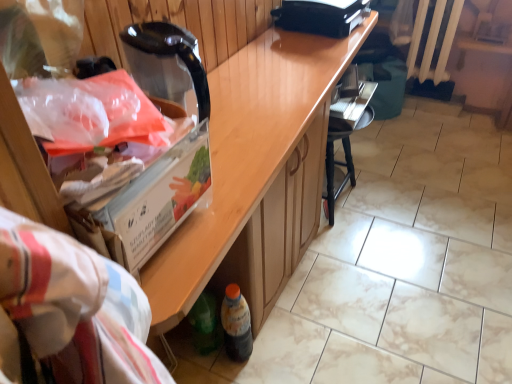
At what (x,y) coordinates should I click in order to perform the action: click on empty space that is ontop of wooden cabinet at center (from a real-world perspective). Please return your answer as a coordinate pair (x, y). Looking at the image, I should click on (269, 89).